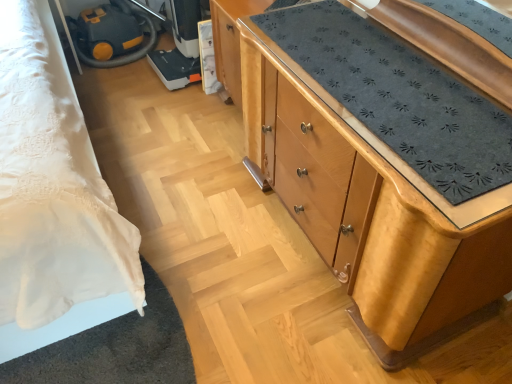
Image resolution: width=512 pixels, height=384 pixels. I want to click on vacant region to the left of wooden chest of drawers at center, so pos(196,231).